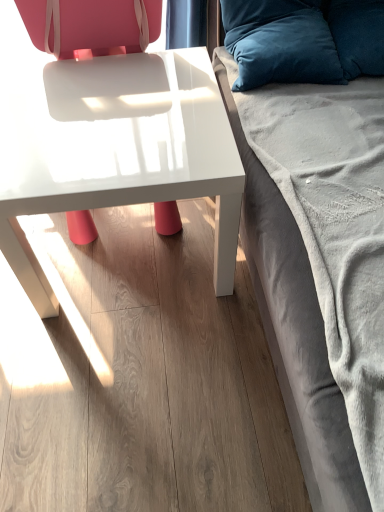
You are a GUI agent. You are given a task and a screenshot of the screen. Output one action in this format:
    pyautogui.click(x=<x>, y=<y>)
    Task: Click on the free space above white glossy table at center (from a real-world perspective)
    
    Given the screenshot: What is the action you would take?
    pyautogui.click(x=102, y=113)